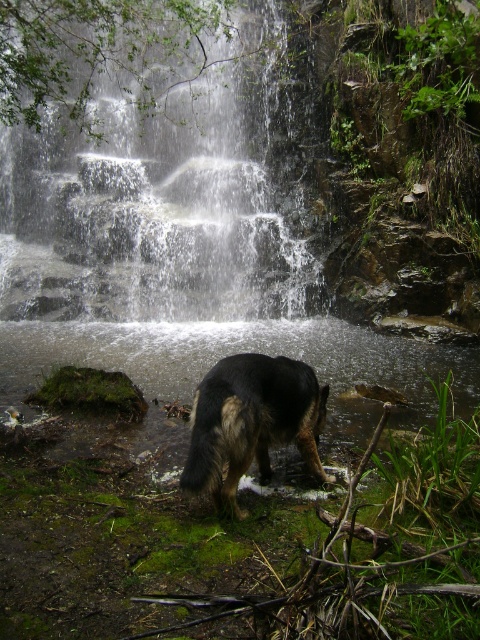
Question: Which point is closer to the camera?

Choices:
 (A) (319, 404)
 (B) (88, 232)

Answer: (A)

Question: Can you confirm if white textured water at center is smaller than dark brown fur dog at center?

Choices:
 (A) yes
 (B) no

Answer: (A)

Question: Does white textured water at center appear on the left side of dark brown fur dog at center?

Choices:
 (A) no
 (B) yes

Answer: (B)

Question: Where is white textured water at center located in relation to dark brown fur dog at center in the image?

Choices:
 (A) above
 (B) below

Answer: (A)